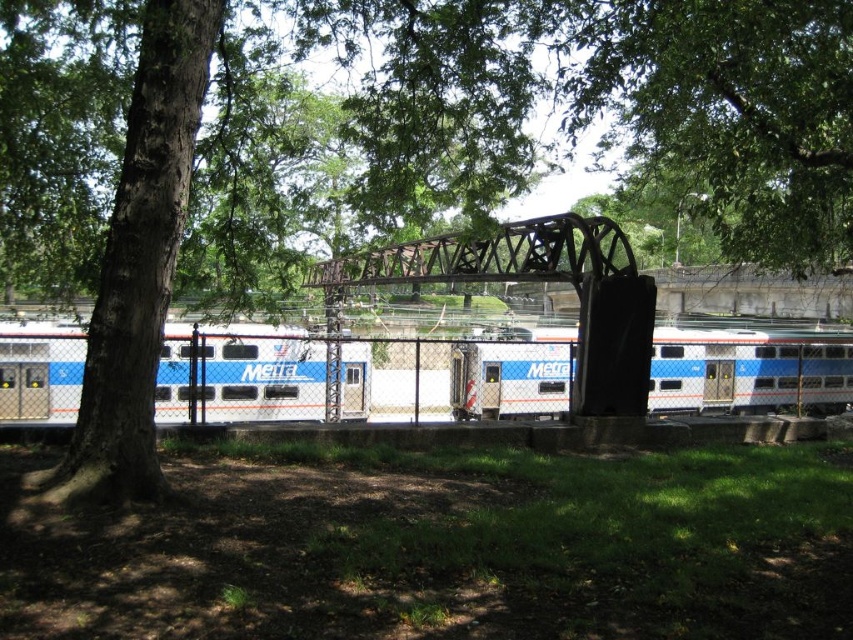
Is point (450, 406) closer to camera compared to point (201, 333)?

No, (450, 406) is behind (201, 333).

Find the location of `white glossy train at center`. white glossy train at center is located at coordinates (749, 371).

Find the location of a particular element. Image resolution: width=853 pixels, height=640 pixels. white glossy train at center is located at coordinates (749, 371).

Who is more forward, (838, 385) or (811, 346)?

Point (811, 346)

Does white glossy train at center appear on the right side of blue and white painted passenger train at center?

No, white glossy train at center is not to the right of blue and white painted passenger train at center.

Is point (285, 326) positioned in front of point (552, 381)?

Yes, it is in front of point (552, 381).

Where is `white glossy train at center`? The width and height of the screenshot is (853, 640). white glossy train at center is located at coordinates [749, 371].

Does blue and white painted passenger train at center appear under silver metallic train at left?

Indeed, blue and white painted passenger train at center is positioned under silver metallic train at left.

Between point (521, 326) and point (345, 374), which one is positioned in front?

Positioned in front is point (345, 374).

Is point (518, 387) positioned in front of point (10, 410)?

That is False.

At what (x,y) coordinates should I click in order to perform the action: click on blue and white painted passenger train at center. Please return your answer as a coordinate pair (x, y). The width and height of the screenshot is (853, 640). Looking at the image, I should click on (749, 371).